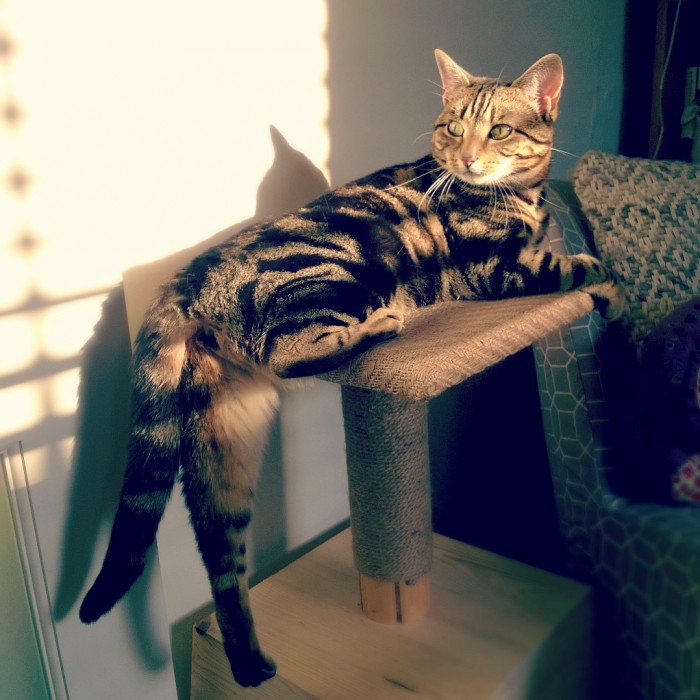
Locate an element on the screen. pillow is located at coordinates (671, 239).